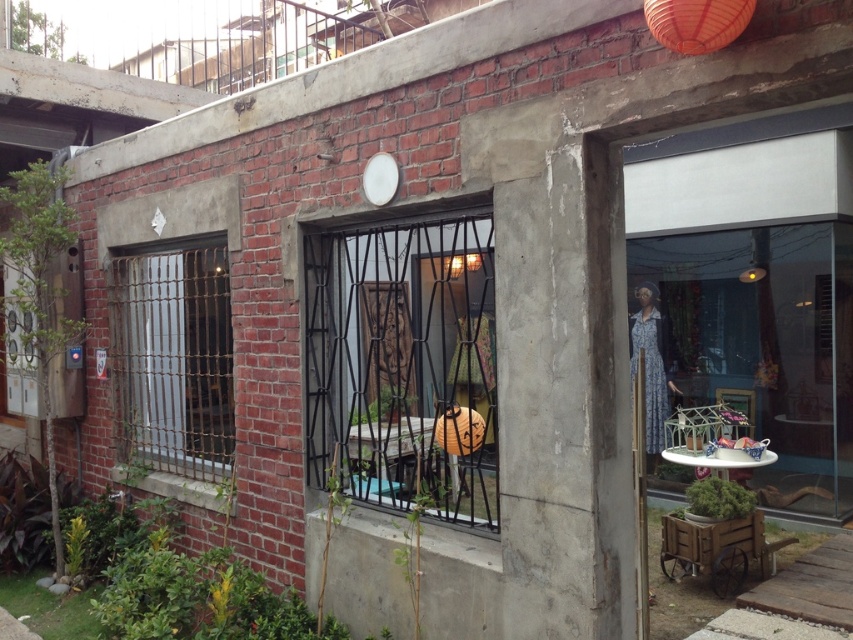
You are a delivery person trying to enter the building through the black metal gate at center. There is an orange matte paper lantern at upper center hanging above the gate. Can you walk through the gate without touching the lantern?

The black metal gate at center is taller than the orange matte paper lantern at upper center. Since the gate is taller, the lantern is positioned above it, so you can walk through the gate without touching the lantern.